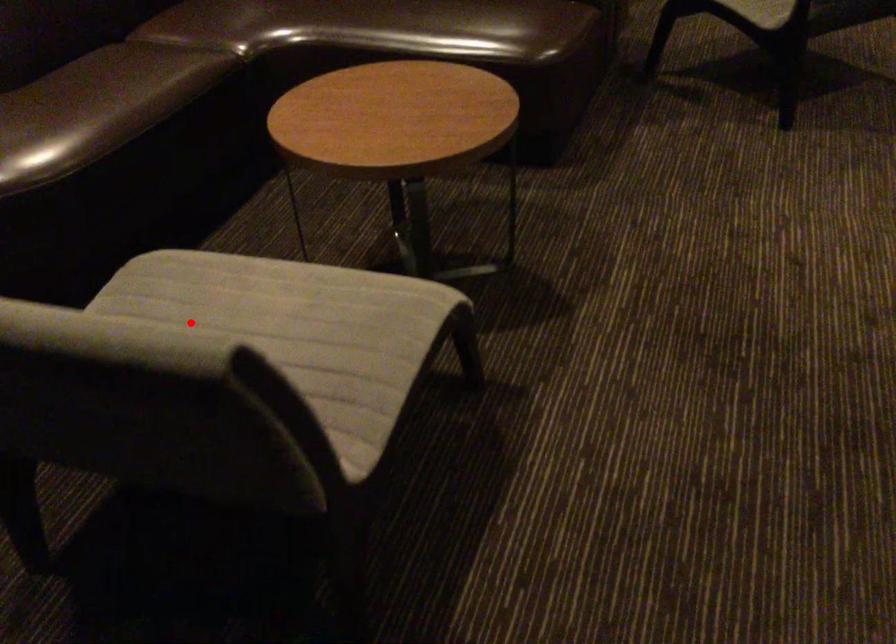
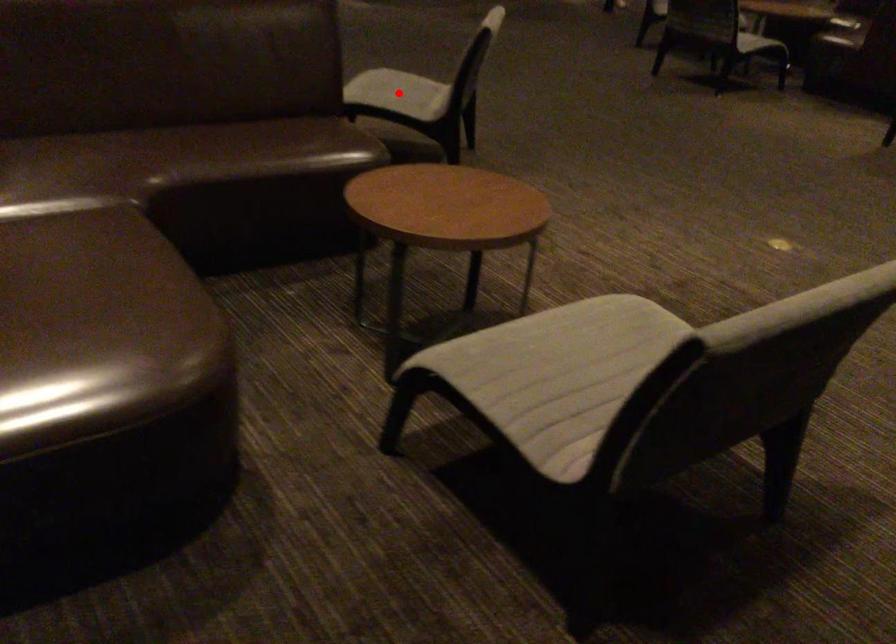
I am providing you with two images of the same scene from different viewpoints. A red point is marked on the first image and another point is marked on the second image. Is the red point in image1 aligned with the point shown in image2?

No